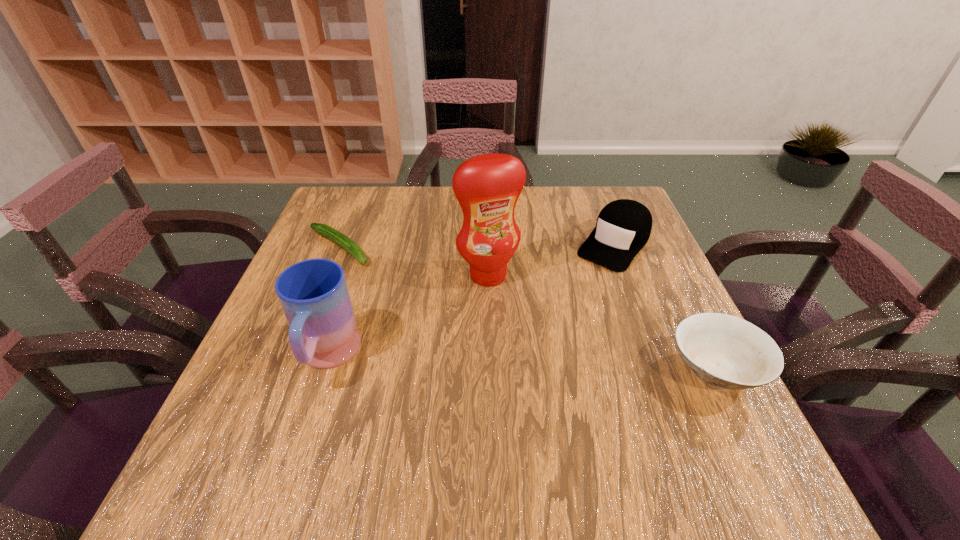
Locate an element on the screen. the fourth shortest object is located at coordinates (313, 293).

At what (x,y) coordinates should I click in order to perform the action: click on the second shortest object. Please return your answer as a coordinate pair (x, y). The width and height of the screenshot is (960, 540). Looking at the image, I should click on (725, 351).

At what (x,y) coordinates should I click in order to perform the action: click on the shortest object. Please return your answer as a coordinate pair (x, y). The height and width of the screenshot is (540, 960). Looking at the image, I should click on (340, 239).

Find the location of a particular element. Image resolution: width=960 pixels, height=540 pixels. condiment is located at coordinates (487, 187).

The height and width of the screenshot is (540, 960). I want to click on the third object from right to left, so click(487, 187).

Locate an element on the screen. The image size is (960, 540). the third tallest object is located at coordinates (623, 227).

Identify the location of blank area located on the side of the second tallest object with the handle. The height and width of the screenshot is (540, 960). (305, 426).

I want to click on free location located 0.380m on the back of the fourth tallest object, so click(x=646, y=230).

Image resolution: width=960 pixels, height=540 pixels. In order to click on vacant space located 0.220m on the front-facing side of the shortest object in this screenshot , I will do `click(418, 304)`.

At what (x,y) coordinates should I click in order to perform the action: click on free space located on the front-facing side of the shortest object. Please return your answer as a coordinate pair (x, y). This screenshot has height=540, width=960. Looking at the image, I should click on (396, 288).